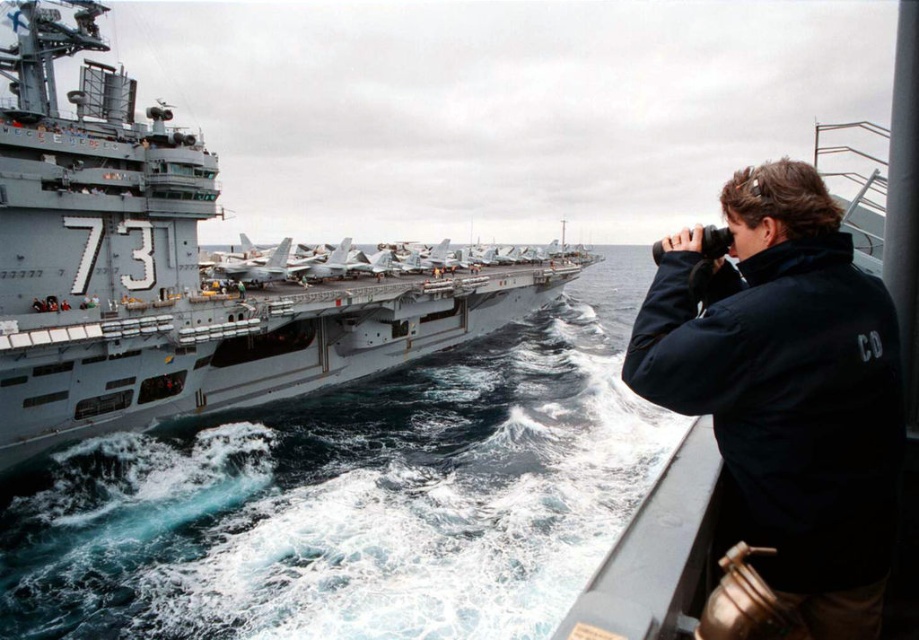
You are a photographer on a boat trying to capture a photo of the gray metallic aircraft carrier at center and the black softshell jacket at right. Since you want to ensure both are in focus, you need to know their relative sizes. Which object is taller?

The gray metallic aircraft carrier at center is taller than the black softshell jacket at right according to the description provided.

You are standing on the deck of the naval aircraft carrier marked with the number 73. You need to reach a specific point for a safety check. The point is located at coordinates point [498,541]. Given that you are currently 2 meters away from the edge of the carrier, can you safely reach this point without going overboard?

The distance of point [498,541] from viewer is 21.90 meters. Since you are currently 2 meters away from the edge, you can safely reach the point as it is within the carrier deck.